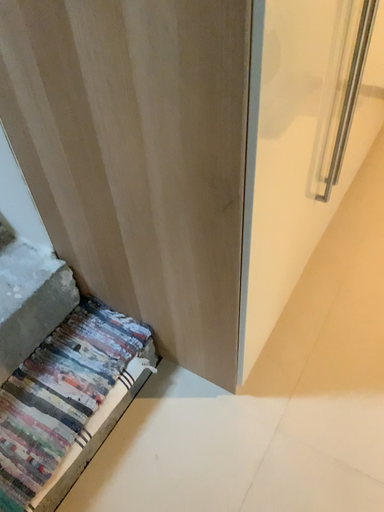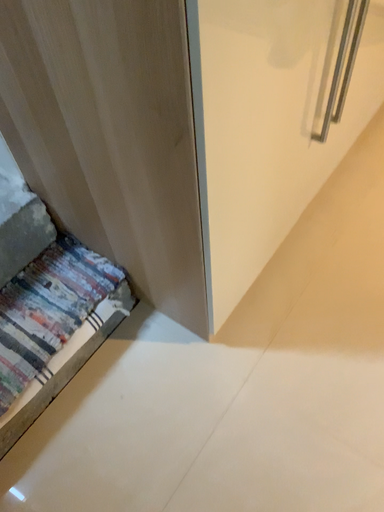
Question: Which way did the camera rotate in the video?

Choices:
 (A) rotated downward
 (B) rotated upward

Answer: (A)